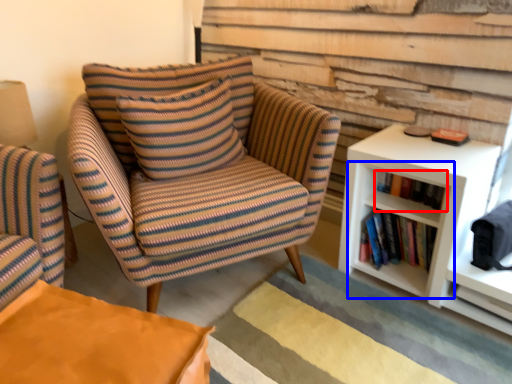
Question: Among these objects, which one is farthest to the camera, book (highlighted by a red box) or shelf (highlighted by a blue box)?

Choices:
 (A) book
 (B) shelf

Answer: (B)